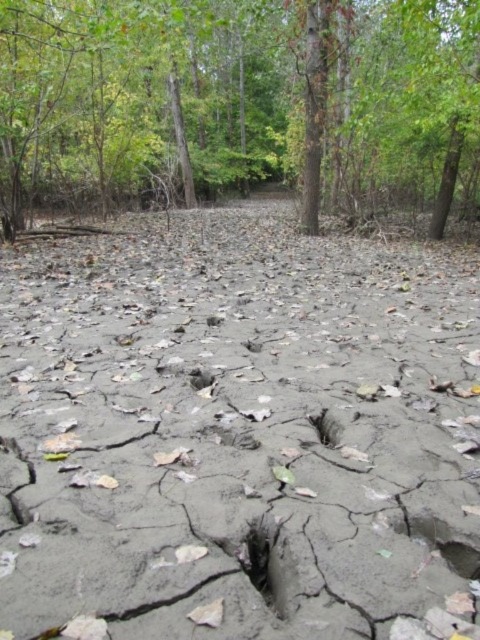
You are a geologist examining the gray cracked mud at center and the smooth gray hole at center in the drought area. Which object is located above the other?

The gray cracked mud at center is positioned over the smooth gray hole at center, so the gray cracked mud at center is above the smooth gray hole at center.

You are standing at the origin point of the image coordinate system. You want to walk to the gray cracked mud at center. What direction should you move in to reach it?

Since the gray cracked mud at center is located at point 0.672 on the x axis and 0.492 on the y axis, you should move towards the right and slightly forward to reach it.